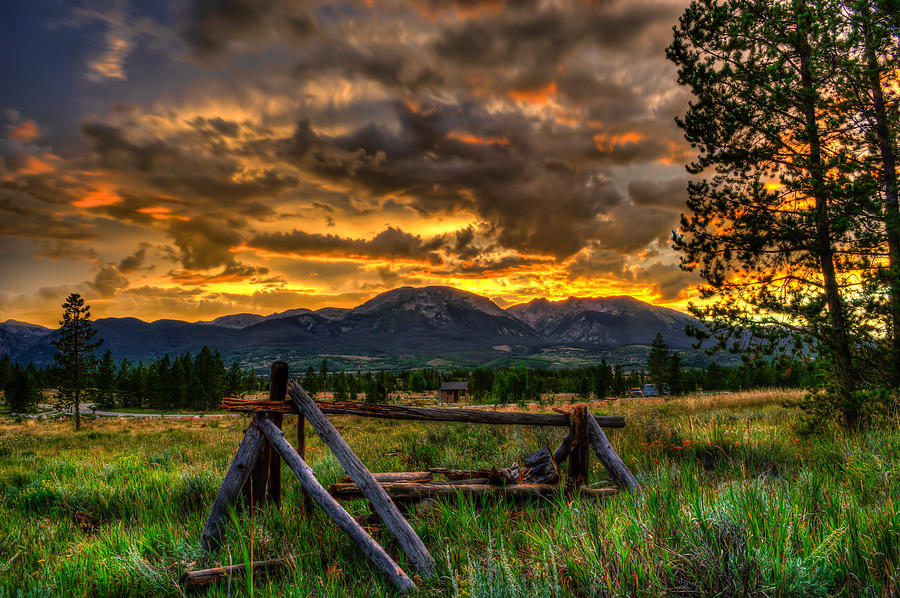
Where is `orange flowers`? orange flowers is located at coordinates (655, 448).